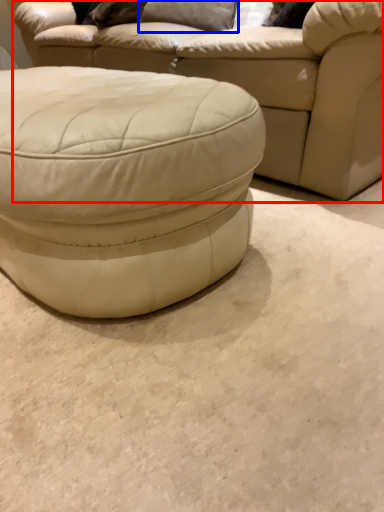
Question: Which object appears farthest to the camera in this image, studio couch (highlighted by a red box) or pillow (highlighted by a blue box)?

Choices:
 (A) studio couch
 (B) pillow

Answer: (B)